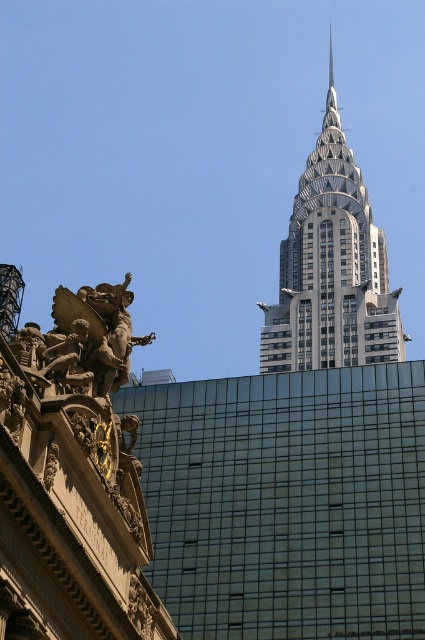
What do you see at coordinates (331, 268) in the screenshot? I see `silver metallic chrysler building at upper center` at bounding box center [331, 268].

Does point (291, 344) come in front of point (59, 291)?

No, it is behind (59, 291).

Who is more distant from viewer, (343, 236) or (81, 355)?

Positioned behind is point (343, 236).

The width and height of the screenshot is (425, 640). I want to click on silver metallic chrysler building at upper center, so click(331, 268).